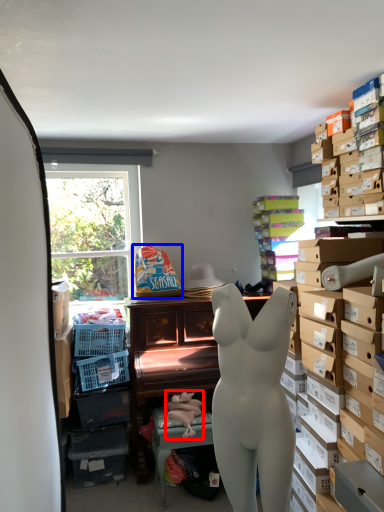
Question: Which object is closer to the camera taking this photo, toy (highlighted by a red box) or toy (highlighted by a blue box)?

Choices:
 (A) toy
 (B) toy

Answer: (A)